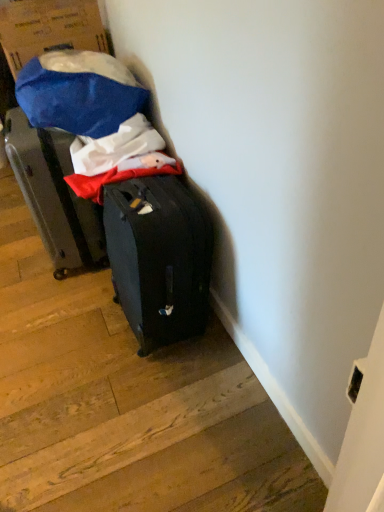
This screenshot has height=512, width=384. In order to click on free space above black hard suitcase at lower center (from a real-world perspective) in this screenshot , I will do `click(145, 377)`.